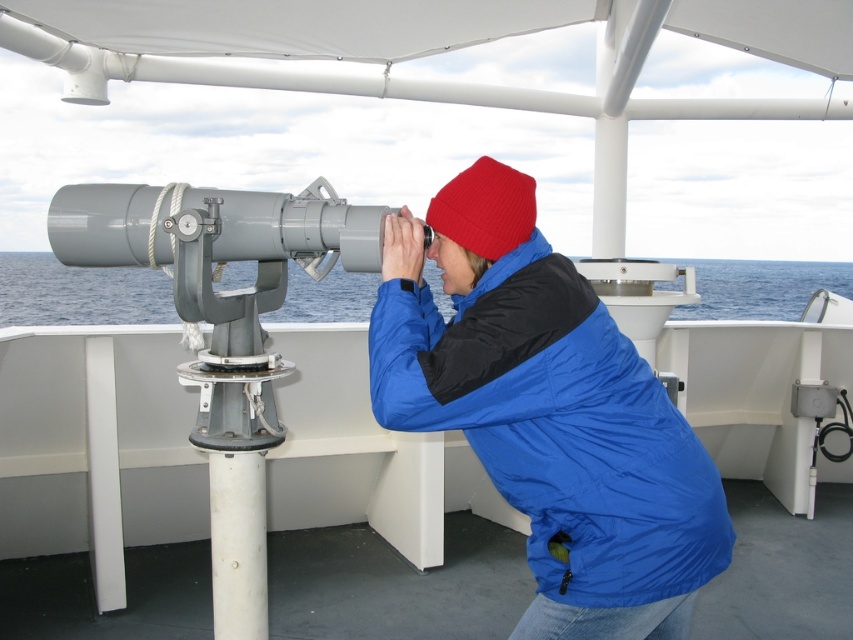
Does blue synthetic jacket at center have a lesser height compared to blue water at center?

Indeed, blue synthetic jacket at center has a lesser height compared to blue water at center.

Is point (495, 276) in front of point (165, 278)?

That is True.

Image resolution: width=853 pixels, height=640 pixels. I want to click on blue synthetic jacket at center, so click(556, 426).

Who is positioned more to the right, blue water at center or red knit beanie at center?

From the viewer's perspective, red knit beanie at center appears more on the right side.

Does point (111, 323) come farther from viewer compared to point (440, 224)?

Yes, it is.

Is point (328, 317) positioned behind point (461, 240)?

Yes, point (328, 317) is farther from viewer.

Locate an element on the screen. Image resolution: width=853 pixels, height=640 pixels. blue water at center is located at coordinates (x=79, y=292).

Does blue synthetic jacket at center appear on the left side of red knit beanie at center?

In fact, blue synthetic jacket at center is to the right of red knit beanie at center.

Based on the photo, which is more to the left, blue synthetic jacket at center or red knit beanie at center?

red knit beanie at center

What do you see at coordinates (556, 426) in the screenshot?
I see `blue synthetic jacket at center` at bounding box center [556, 426].

Find the location of `blue synthetic jacket at center`. blue synthetic jacket at center is located at coordinates (556, 426).